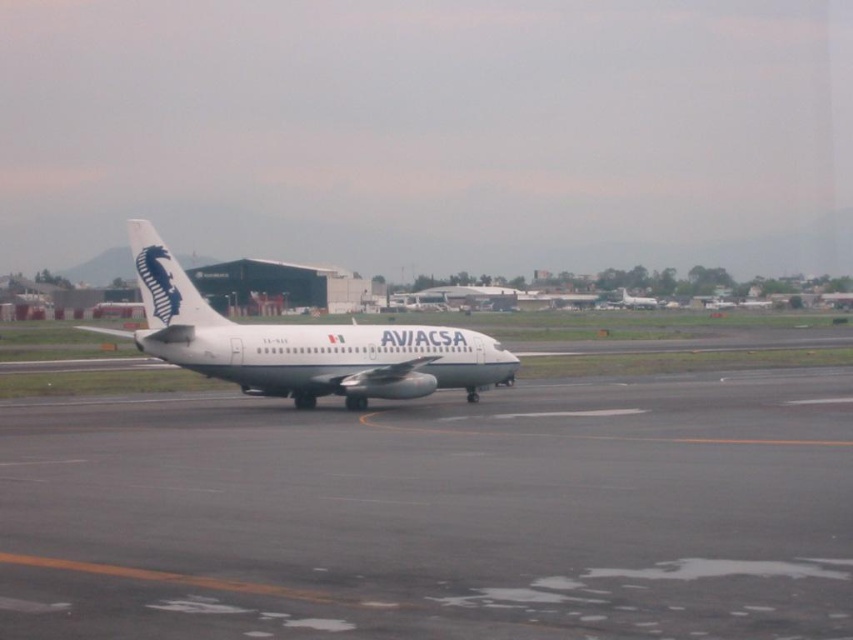
Question: Which point is closer to the camera?

Choices:
 (A) (187, 356)
 (B) (85, 589)
 (C) (637, 298)

Answer: (B)

Question: Is white matte airplane at center to the left of white glossy airplane at center from the viewer's perspective?

Choices:
 (A) yes
 (B) no

Answer: (A)

Question: In this image, where is white matte airplane at center located relative to white glossy airplane at center?

Choices:
 (A) above
 (B) below

Answer: (B)

Question: Which object is the closest to the white glossy airplane at center?

Choices:
 (A) gray asphalt runway at center
 (B) white matte airplane at center

Answer: (B)

Question: Can you confirm if white matte airplane at center is smaller than white glossy airplane at center?

Choices:
 (A) yes
 (B) no

Answer: (B)

Question: Estimate the real-world distances between objects in this image. Which object is farther from the white matte airplane at center?

Choices:
 (A) white glossy airplane at center
 (B) gray asphalt runway at center

Answer: (A)